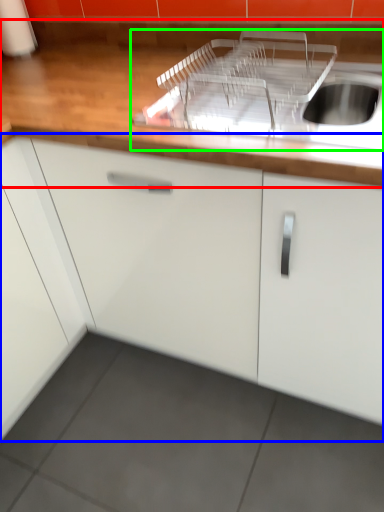
Question: Considering the real-world distances, which object is closest to countertop (highlighted by a red box)? cabinetry (highlighted by a blue box) or sink (highlighted by a green box).

Choices:
 (A) cabinetry
 (B) sink

Answer: (B)